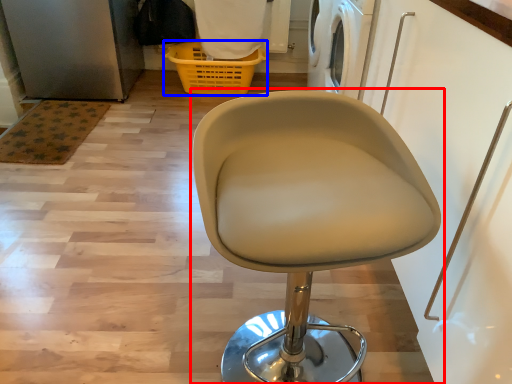
Question: Which point is closer to the camera, chair (highlighted by a red box) or basket (highlighted by a blue box)?

Choices:
 (A) chair
 (B) basket

Answer: (A)